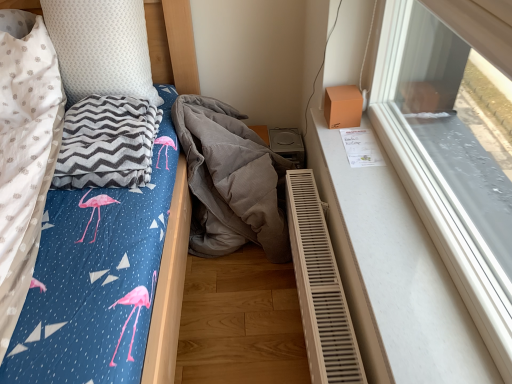
Question: Is white dotted pillow at upper left looking in the opposite direction of gray zigzag blanket at left?

Choices:
 (A) yes
 (B) no

Answer: (B)

Question: Considering the relative sizes of white dotted pillow at upper left and gray zigzag blanket at left in the image provided, is white dotted pillow at upper left shorter than gray zigzag blanket at left?

Choices:
 (A) yes
 (B) no

Answer: (B)

Question: Is white dotted pillow at upper left facing towards gray zigzag blanket at left?

Choices:
 (A) yes
 (B) no

Answer: (A)

Question: Is gray zigzag blanket at left located within white dotted pillow at upper left?

Choices:
 (A) yes
 (B) no

Answer: (B)

Question: Considering the relative sizes of white dotted pillow at upper left and gray zigzag blanket at left in the image provided, is white dotted pillow at upper left taller than gray zigzag blanket at left?

Choices:
 (A) no
 (B) yes

Answer: (B)

Question: Is white dotted pillow at upper left directly adjacent to gray zigzag blanket at left?

Choices:
 (A) no
 (B) yes

Answer: (A)

Question: Is white dotted pillow at upper left shorter than transparent glass window at upper right?

Choices:
 (A) no
 (B) yes

Answer: (B)

Question: Would you say white dotted pillow at upper left is a long distance from transparent glass window at upper right?

Choices:
 (A) yes
 (B) no

Answer: (B)

Question: Is white dotted pillow at upper left outside of transparent glass window at upper right?

Choices:
 (A) yes
 (B) no

Answer: (A)

Question: Considering the relative sizes of white dotted pillow at upper left and transparent glass window at upper right in the image provided, is white dotted pillow at upper left wider than transparent glass window at upper right?

Choices:
 (A) no
 (B) yes

Answer: (B)

Question: Is white dotted pillow at upper left thinner than transparent glass window at upper right?

Choices:
 (A) yes
 (B) no

Answer: (B)

Question: Considering the relative sizes of white dotted pillow at upper left and transparent glass window at upper right in the image provided, is white dotted pillow at upper left smaller than transparent glass window at upper right?

Choices:
 (A) no
 (B) yes

Answer: (B)

Question: Can you see gray zigzag blanket at left touching white dotted pillow at upper left?

Choices:
 (A) yes
 (B) no

Answer: (B)